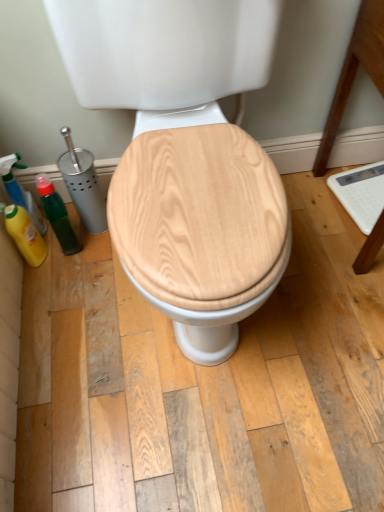
The width and height of the screenshot is (384, 512). In order to click on free space to the right of matte green spray bottle at left, marked as the 2th cleaning product in a bottom-to-top arrangement in this screenshot , I will do `click(83, 234)`.